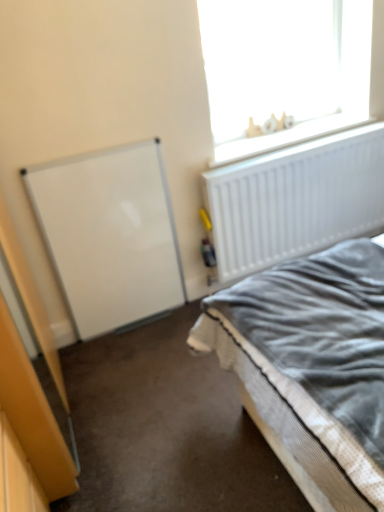
This screenshot has height=512, width=384. In order to click on white matte love sign at upper right in this screenshot , I will do `click(307, 120)`.

This screenshot has width=384, height=512. I want to click on textured gray bed at lower right, so pos(312,365).

At what (x,y) coordinates should I click in order to perform the action: click on white plastic letters at upper right. Please return your answer as a coordinate pair (x, y). The height and width of the screenshot is (512, 384). Looking at the image, I should click on (286, 137).

Measure the distance between white plastic letters at upper right and camera.

white plastic letters at upper right and camera are 2.04 meters apart from each other.

You are a GUI agent. You are given a task and a screenshot of the screen. Output one action in this format:
    pyautogui.click(x=<x>, y=<y>)
    Task: Click on the white matte love sign at upper right
    The height and width of the screenshot is (512, 384).
    Given the screenshot: What is the action you would take?
    pyautogui.click(x=307, y=120)

Do you think white matte love sign at upper right is within textured gray bed at lower right, or outside of it?

white matte love sign at upper right exists outside the volume of textured gray bed at lower right.

Is white matte love sign at upper right positioned with its back to textured gray bed at lower right?

No.

Is point (344, 112) in front of point (285, 386)?

No, it is not.

Would you consider white matte love sign at upper right to be distant from textured gray bed at lower right?

Absolutely, white matte love sign at upper right is distant from textured gray bed at lower right.

From the picture: Would you say white matte love sign at upper right is a long distance from white plastic letters at upper right?

No, there isn't a large distance between white matte love sign at upper right and white plastic letters at upper right.

Can you confirm if white matte love sign at upper right is smaller than white plastic letters at upper right?

No, white matte love sign at upper right is not smaller than white plastic letters at upper right.

From the image's perspective, is white matte love sign at upper right on white plastic letters at upper right?

Yes.

Between white matte love sign at upper right and white plastic letters at upper right, which one appears on the left side from the viewer's perspective?

white matte love sign at upper right is more to the left.

Can you tell me how much white plastic letters at upper right and textured gray bed at lower right differ in facing direction?

The facing directions of white plastic letters at upper right and textured gray bed at lower right are 0.0726 degrees apart.

Which object is wider, white plastic letters at upper right or textured gray bed at lower right?

textured gray bed at lower right is wider.

Is white plastic letters at upper right taller or shorter than textured gray bed at lower right?

white plastic letters at upper right is taller than textured gray bed at lower right.

From a real-world perspective, is textured gray bed at lower right above or below white matte love sign at upper right?

From a real-world perspective, textured gray bed at lower right is physically below white matte love sign at upper right.

Which is in front, point (255, 277) or point (209, 45)?

Point (255, 277)

Which object is positioned more to the left, textured gray bed at lower right or white matte love sign at upper right?

Positioned to the left is textured gray bed at lower right.

Can you confirm if textured gray bed at lower right is positioned to the right of white plastic letters at upper right?

Incorrect, textured gray bed at lower right is not on the right side of white plastic letters at upper right.

From a real-world perspective, is textured gray bed at lower right below white plastic letters at upper right?

Yes.

Considering the positions of objects textured gray bed at lower right and white plastic letters at upper right in the image provided, who is behind, textured gray bed at lower right or white plastic letters at upper right?

white plastic letters at upper right.

Does white plastic letters at upper right lie behind white matte love sign at upper right?

Yes, it is behind white matte love sign at upper right.

Between white plastic letters at upper right and white matte love sign at upper right, which one has larger width?

white plastic letters at upper right.

Could you tell me if white plastic letters at upper right is facing white matte love sign at upper right?

No, white plastic letters at upper right is not facing towards white matte love sign at upper right.

Locate an element on the screen. window sill below the white matte love sign at upper right (from a real-world perspective) is located at coordinates (286, 137).

Find the location of a particular element. The height and width of the screenshot is (512, 384). bed below the white matte love sign at upper right (from a real-world perspective) is located at coordinates (312, 365).

Where is `window on the left of white plastic letters at upper right`? window on the left of white plastic letters at upper right is located at coordinates [307, 120].

When comparing their distances from white matte love sign at upper right, does textured gray bed at lower right or white plastic letters at upper right seem closer?

white plastic letters at upper right lies closer to white matte love sign at upper right than the other object.

Based on their spatial positions, is white plastic letters at upper right or textured gray bed at lower right further from white matte love sign at upper right?

A: textured gray bed at lower right.

From the image, which object appears to be farther from textured gray bed at lower right, white matte love sign at upper right or white plastic letters at upper right?

white matte love sign at upper right is positioned further to the anchor textured gray bed at lower right.

Looking at the image, which one is located closer to textured gray bed at lower right, white plastic letters at upper right or white matte love sign at upper right?

white plastic letters at upper right is positioned closer to the anchor textured gray bed at lower right.

From the image, which object appears to be farther from white plastic letters at upper right, textured gray bed at lower right or white matte love sign at upper right?

Among the two, textured gray bed at lower right is located further to white plastic letters at upper right.

When comparing their distances from white plastic letters at upper right, does white matte love sign at upper right or textured gray bed at lower right seem further?

The object further to white plastic letters at upper right is textured gray bed at lower right.

Find the location of a particular element. window sill between white matte love sign at upper right and textured gray bed at lower right vertically is located at coordinates (286, 137).